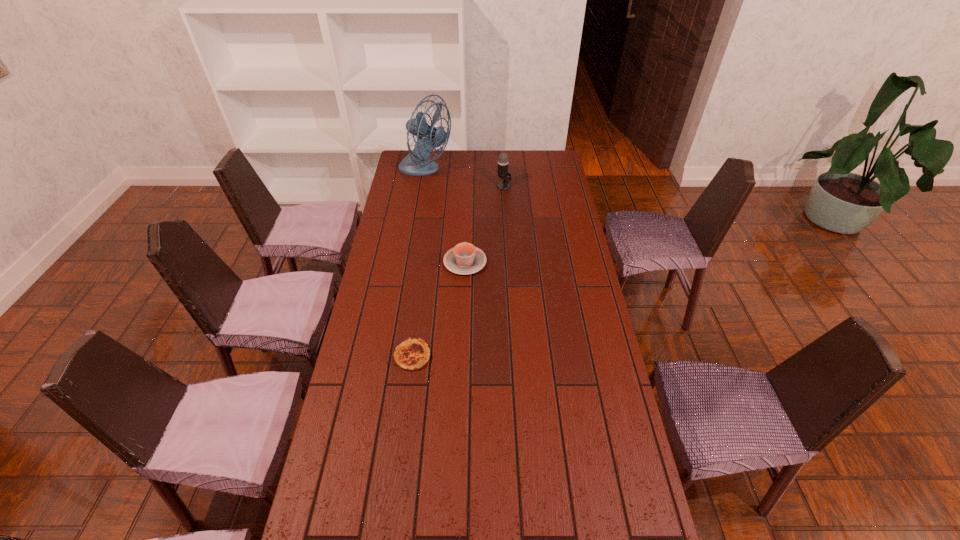
Locate an element on the screen. The image size is (960, 540). fan is located at coordinates (429, 137).

The image size is (960, 540). Find the location of `the second tallest object`. the second tallest object is located at coordinates (503, 162).

You are a GUI agent. You are given a task and a screenshot of the screen. Output one action in this format:
    pyautogui.click(x=<x>, y=<y>)
    Task: Click on the microphone
    Image resolution: width=960 pixels, height=540 pixels.
    Given the screenshot: What is the action you would take?
    pyautogui.click(x=503, y=162)

Locate an element on the screen. the third farthest object is located at coordinates (464, 259).

Locate an element on the screen. the third tallest object is located at coordinates (464, 259).

Where is `quiche`? quiche is located at coordinates (411, 355).

At what (x,y) coordinates should I click in order to perform the action: click on the nearest object. Please return your answer as a coordinate pair (x, y). The height and width of the screenshot is (540, 960). Looking at the image, I should click on (411, 355).

Where is `vacant point located in front of the tallest object to blow air`? The image size is (960, 540). vacant point located in front of the tallest object to blow air is located at coordinates (493, 172).

At what (x,y) coordinates should I click in order to perform the action: click on vacant region located 0.120m on the back of the third shortest object. Please return your answer as a coordinate pair (x, y). Looking at the image, I should click on (502, 169).

Where is `vacant space situated 0.210m on the handle side of the third farthest object`? The width and height of the screenshot is (960, 540). vacant space situated 0.210m on the handle side of the third farthest object is located at coordinates (467, 217).